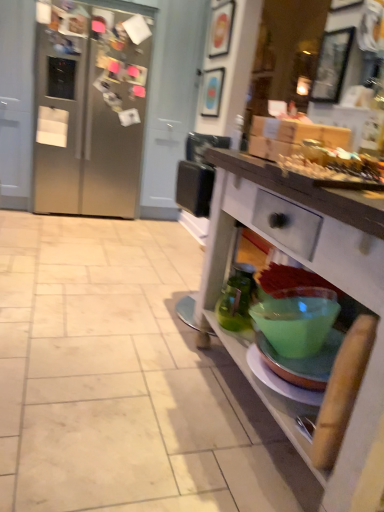
Question: Is matte blue picture frame at upper center, which appears as the 2th picture frame when viewed from the top, smaller than wooden picture frame at upper center, which is the 1th picture frame in top-to-bottom order?

Choices:
 (A) no
 (B) yes

Answer: (B)

Question: From a real-world perspective, is matte blue picture frame at upper center, the 2th picture frame positioned from the bottom, physically above wooden picture frame at upper center, which is counted as the 2th picture frame, starting from the front?

Choices:
 (A) yes
 (B) no

Answer: (B)

Question: Is matte blue picture frame at upper center, the 2th picture frame positioned from the bottom, turned away from wooden picture frame at upper center, which is the 1th picture frame in top-to-bottom order?

Choices:
 (A) no
 (B) yes

Answer: (A)

Question: From the image's perspective, is matte blue picture frame at upper center, the 1th picture frame from the back, above wooden picture frame at upper center, acting as the 2th picture frame starting from the right?

Choices:
 (A) no
 (B) yes

Answer: (A)

Question: Is matte blue picture frame at upper center, which ranks as the 1th picture frame in left-to-right order, shorter than wooden picture frame at upper center, which is the second picture frame in back-to-front order?

Choices:
 (A) no
 (B) yes

Answer: (A)

Question: In the image, is wooden picture frame at upper right, the first picture frame ordered from the bottom, on the left side or the right side of matte blue picture frame at upper center, which appears as the 2th picture frame when viewed from the top?

Choices:
 (A) right
 (B) left

Answer: (A)

Question: Is wooden picture frame at upper right, the first picture frame ordered from the bottom, spatially inside matte blue picture frame at upper center, marked as the third picture frame in a front-to-back arrangement, or outside of it?

Choices:
 (A) inside
 (B) outside

Answer: (B)

Question: Is point (317, 80) closer or farther from the camera than point (216, 90)?

Choices:
 (A) farther
 (B) closer

Answer: (B)

Question: In terms of width, does wooden picture frame at upper right, placed as the first picture frame when sorted from right to left, look wider or thinner when compared to matte blue picture frame at upper center, the 1th picture frame from the back?

Choices:
 (A) thin
 (B) wide

Answer: (A)

Question: Is matte blue picture frame at upper center, the 1th picture frame from the back, taller or shorter than wooden picture frame at upper center, which is counted as the 2th picture frame, starting from the front?

Choices:
 (A) short
 (B) tall

Answer: (B)

Question: Is matte blue picture frame at upper center, the 2th picture frame positioned from the bottom, in front of or behind wooden picture frame at upper center, which is counted as the 2th picture frame, starting from the front, in the image?

Choices:
 (A) behind
 (B) front

Answer: (A)

Question: Based on their sizes in the image, would you say matte blue picture frame at upper center, which appears as the 2th picture frame when viewed from the top, is bigger or smaller than wooden picture frame at upper center, the 3th picture frame ordered from the bottom?

Choices:
 (A) small
 (B) big

Answer: (A)

Question: From a real-world perspective, is matte blue picture frame at upper center, the 1th picture frame from the back, physically located above or below wooden picture frame at upper center, which is the 1th picture frame in top-to-bottom order?

Choices:
 (A) above
 (B) below

Answer: (B)

Question: Looking at their shapes, would you say wooden picture frame at upper center, acting as the 2th picture frame starting from the right, is wider or thinner than satin silver refrigerator at left?

Choices:
 (A) thin
 (B) wide

Answer: (A)

Question: Considering the positions of point (226, 14) and point (87, 70), is point (226, 14) closer or farther from the camera than point (87, 70)?

Choices:
 (A) farther
 (B) closer

Answer: (B)